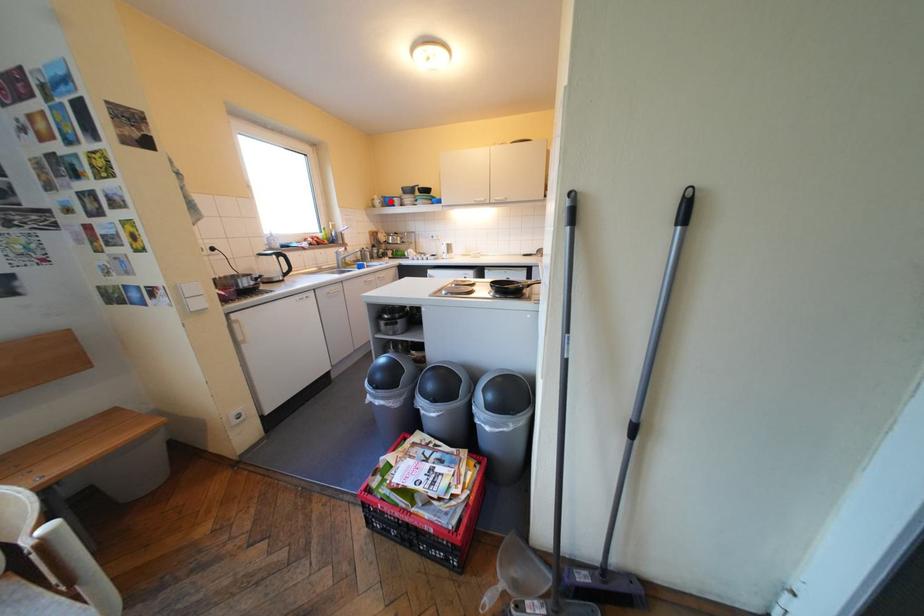
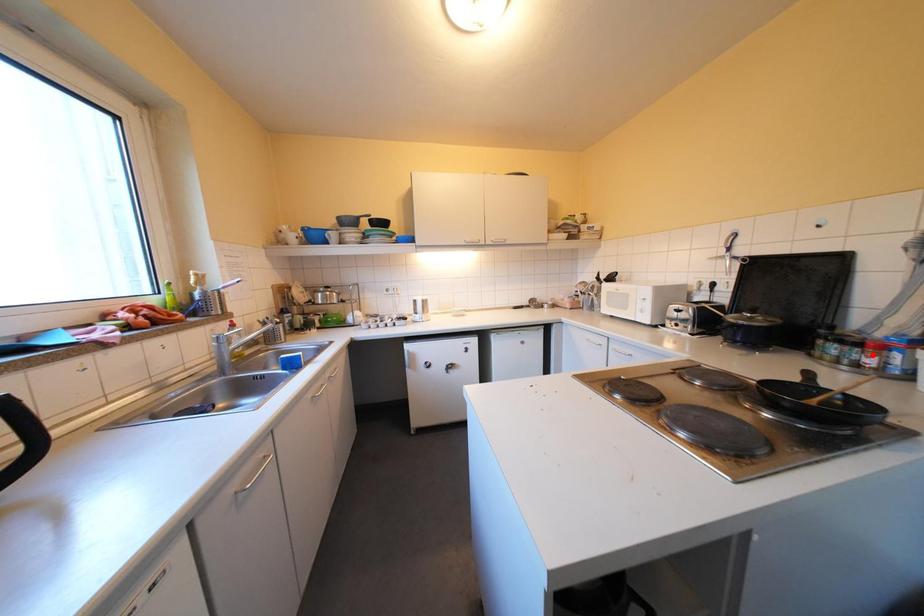
I am providing you with two images of the same scene from different viewpoints. A red point is marked on the first image and another point is marked on the second image. Is the red point in image1 aligned with the point shown in image2?

No